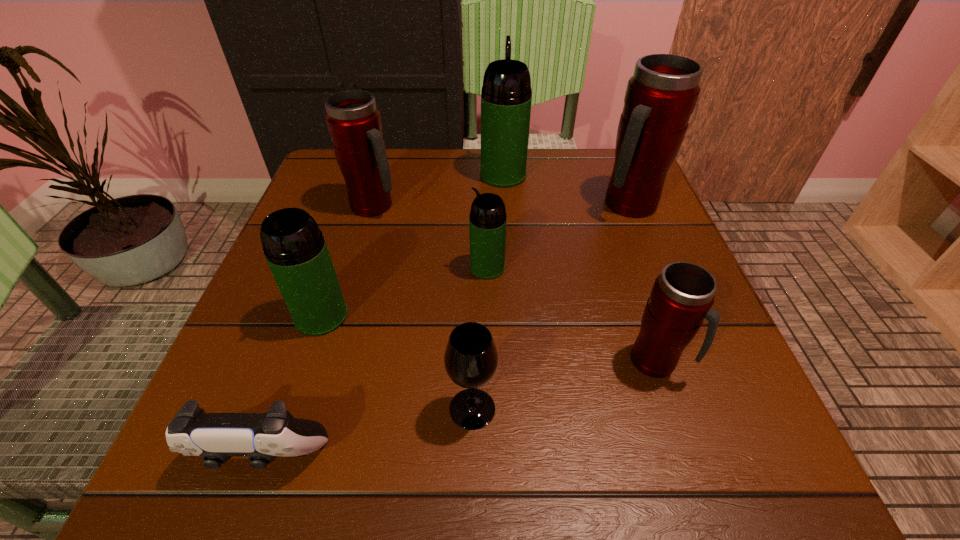
Locate an element on the screen. The width and height of the screenshot is (960, 540). free point between the leftmost red thermos bottle and the farthest green thermos bottle is located at coordinates (439, 191).

The image size is (960, 540). Find the location of `free space that is in between the biggest red thermos bottle and the wineglass`. free space that is in between the biggest red thermos bottle and the wineglass is located at coordinates (551, 307).

Find the location of a particular element. Image resolution: width=960 pixels, height=540 pixels. vacant region between the leftmost red thermos bottle and the fifth nearest object is located at coordinates (431, 237).

Image resolution: width=960 pixels, height=540 pixels. Find the location of `unoccupied position between the control and the second nearest green thermos bottle`. unoccupied position between the control and the second nearest green thermos bottle is located at coordinates [374, 362].

I want to click on vacant area that lies between the nearest green thermos bottle and the wineglass, so click(x=396, y=362).

Where is `free space between the second nearest green thermos bottle and the control`? Image resolution: width=960 pixels, height=540 pixels. free space between the second nearest green thermos bottle and the control is located at coordinates (374, 362).

Locate an element on the screen. This screenshot has height=540, width=960. vacant area that lies between the control and the wineglass is located at coordinates (367, 433).

The image size is (960, 540). I want to click on object that is the fourth closest to the third nearest object, so click(x=216, y=437).

Select which object is the fifth closest to the control. Please provide its 2D coordinates. Your answer should be formatted as a tuple, i.e. [(x, y)], where the tuple contains the x and y coordinates of a point satisfying the conditions above.

[(354, 122)]

Identify the location of thermos bottle that is the second closest to the wineglass. The image size is (960, 540). (682, 295).